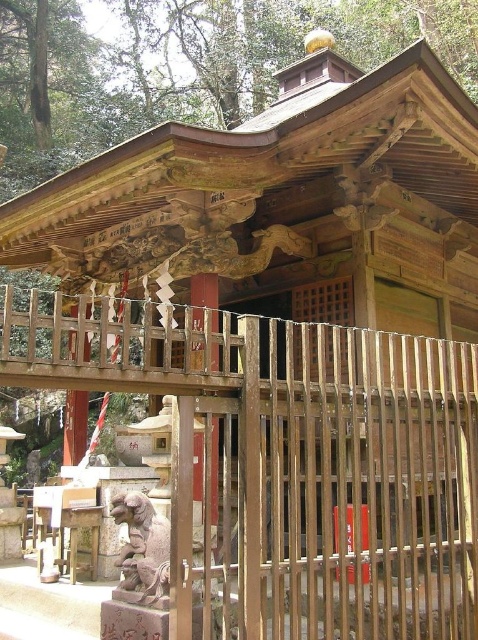
Which is behind, point (208, 300) or point (71, 310)?

Point (71, 310)

Between point (213, 360) and point (74, 454), which one is positioned in front?

Positioned in front is point (213, 360).

In order to click on brown wooden pillar at center in this screenshot , I will do `click(204, 298)`.